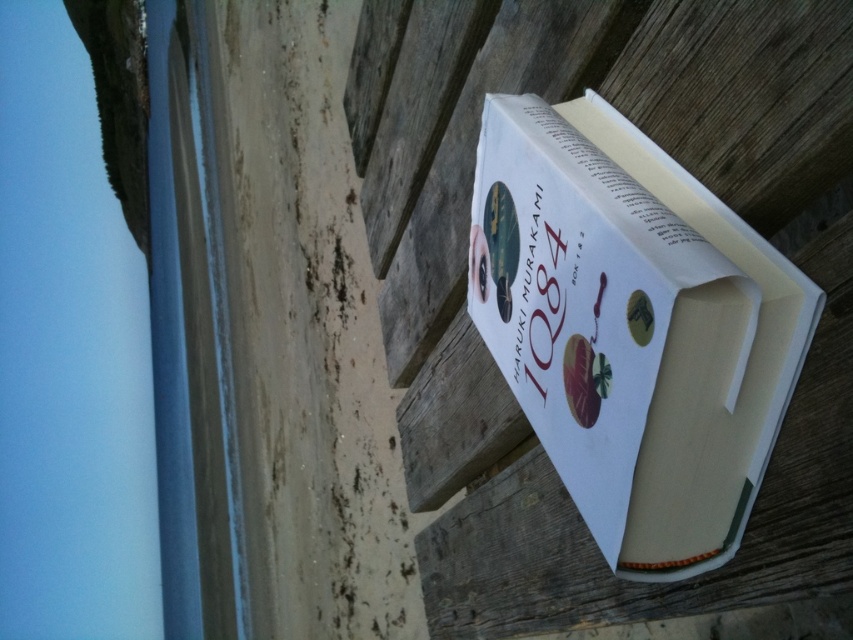
Based on the photo, you are organizing a bookshelf and need to place the white paper book at center and the white paper at upper center. Which object has a greater width?

The white paper book at center has a greater width than the white paper at upper center according to the description.